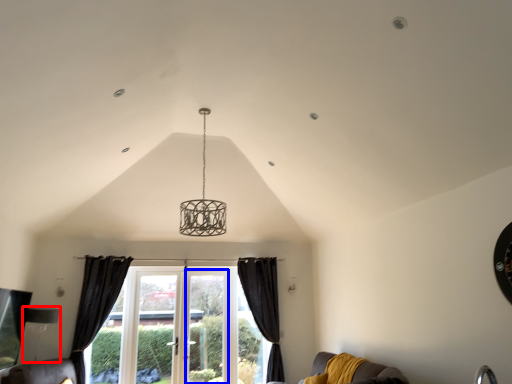
Question: Which point is closer to the camera, lamp (highlighted by a red box) or screen door (highlighted by a blue box)?

Choices:
 (A) lamp
 (B) screen door

Answer: (A)